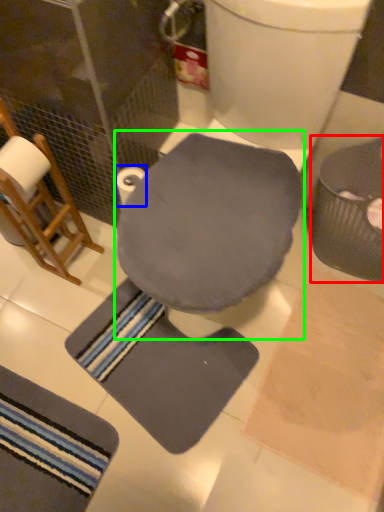
Question: Which object is the closest to the potty (highlighted by a red box)? Choose among these: toilet paper (highlighted by a blue box) or swivel chair (highlighted by a green box).

Choices:
 (A) toilet paper
 (B) swivel chair

Answer: (B)